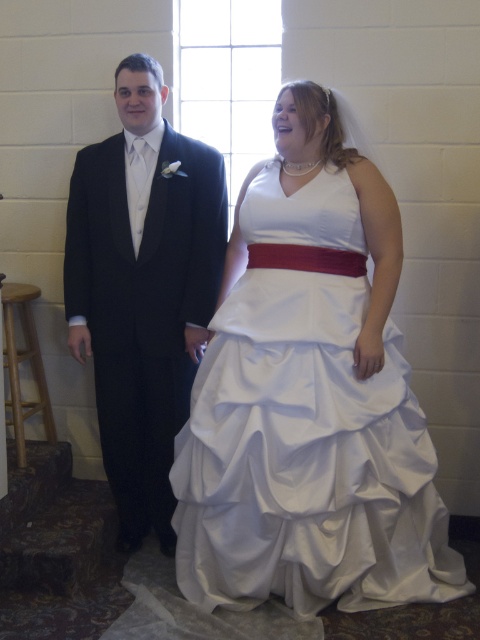
Question: Which point appears closest to the camera in this image?

Choices:
 (A) (264, 588)
 (B) (137, 122)

Answer: (A)

Question: Is the position of white satin dress at center less distant than that of black satin suit at left?

Choices:
 (A) no
 (B) yes

Answer: (B)

Question: Is the position of white satin dress at center less distant than that of black satin suit at left?

Choices:
 (A) no
 (B) yes

Answer: (B)

Question: Considering the relative positions of white satin dress at center and black satin suit at left in the image provided, where is white satin dress at center located with respect to black satin suit at left?

Choices:
 (A) above
 (B) below

Answer: (B)

Question: Which object is closer to the camera taking this photo?

Choices:
 (A) black satin suit at left
 (B) white satin dress at center

Answer: (B)